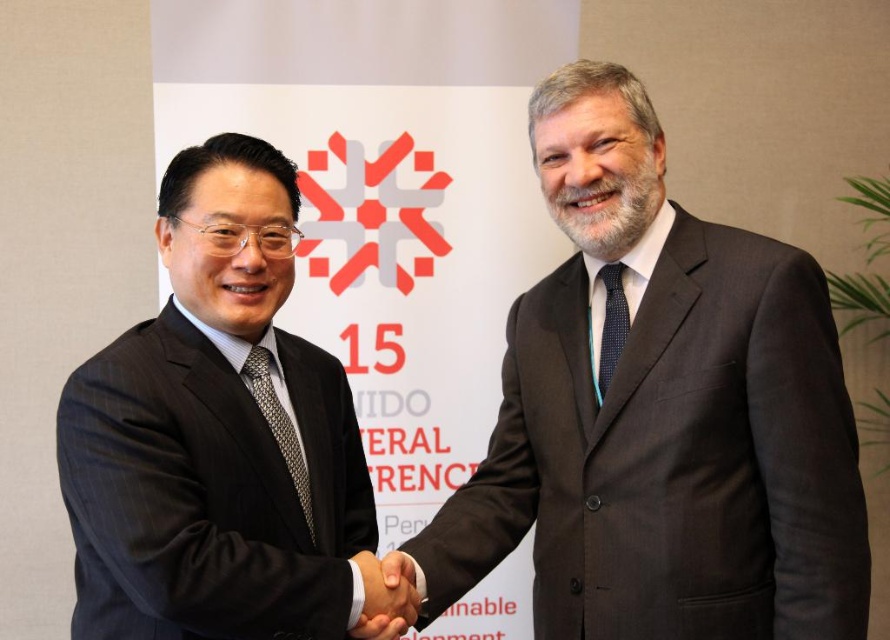
You are a photographer at the event and need to ensure the black glossy hand at center and the silver metallic tie at center are both visible in the photo. Given their relative sizes, which object might appear smaller in the final image?

The black glossy hand at center appears smaller in the photo because it is not as tall as the silver metallic tie at center.

You are a photographer at the event and need to ensure both the dark gray suit at center and the polka dot silk tie at center are visible in the photo. Given their sizes, which one might require you to adjust your camera angle to capture fully?

The dark gray suit at center is taller than the polka dot silk tie at center, so adjusting the camera angle to focus on the dark gray suit at center would ensure both are visible.